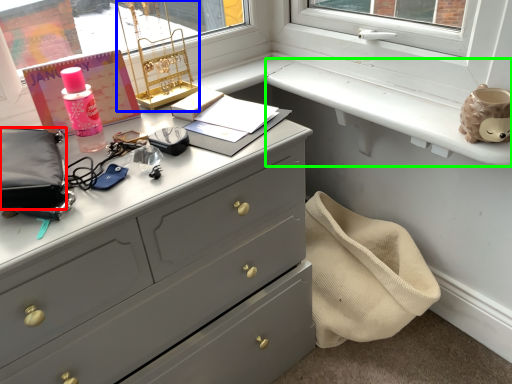
Question: Estimate the real-world distances between objects in this image. Which object is closer to pouch (highlighted by a red box), table lamp (highlighted by a blue box) or window sill (highlighted by a green box)?

Choices:
 (A) table lamp
 (B) window sill

Answer: (A)